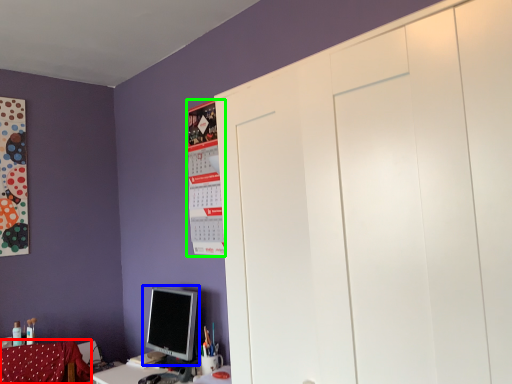
Question: Which is farther away from swivel chair (highlighted by a red box)? computer monitor (highlighted by a blue box) or bulletin board (highlighted by a green box)?

Choices:
 (A) computer monitor
 (B) bulletin board

Answer: (B)